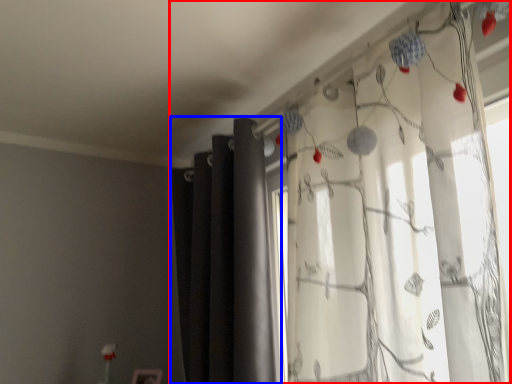
Question: Which object appears farthest to the camera in this image, curtain (highlighted by a red box) or curtain (highlighted by a blue box)?

Choices:
 (A) curtain
 (B) curtain

Answer: (B)